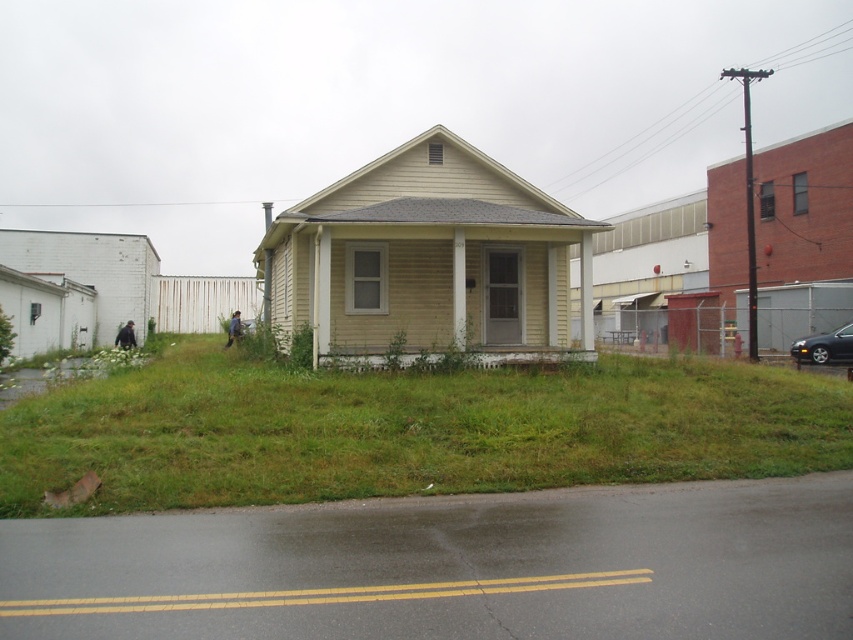
Question: Does green grassy at center appear over shiny silver sedan at lower right?

Choices:
 (A) yes
 (B) no

Answer: (B)

Question: Which point is farther to the camera?

Choices:
 (A) (498, 442)
 (B) (834, 349)

Answer: (B)

Question: Which point appears farthest from the camera in this image?

Choices:
 (A) (791, 406)
 (B) (804, 349)

Answer: (B)

Question: Does green grassy at center have a larger size compared to shiny silver sedan at lower right?

Choices:
 (A) yes
 (B) no

Answer: (A)

Question: Is green grassy at center to the right of shiny silver sedan at lower right from the viewer's perspective?

Choices:
 (A) no
 (B) yes

Answer: (A)